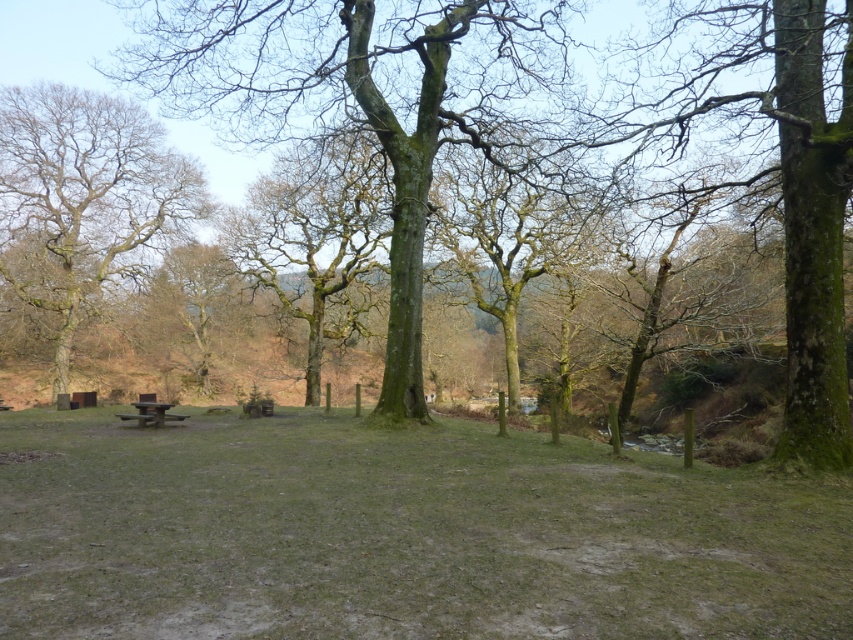
Question: From the image, what is the correct spatial relationship of green grassy field at center in relation to green mossy tree at center?

Choices:
 (A) above
 (B) below

Answer: (B)

Question: Does green grassy field at center have a lesser width compared to wooden park bench at center?

Choices:
 (A) yes
 (B) no

Answer: (B)

Question: Can you confirm if green mossy tree at center is positioned to the left of wooden picnic table at lower left?

Choices:
 (A) yes
 (B) no

Answer: (B)

Question: Considering the real-world distances, which object is closest to the wooden picnic table at lower left?

Choices:
 (A) wooden park bench at center
 (B) green mossy tree at center
 (C) green mossy tree at left
 (D) green grassy field at center

Answer: (A)

Question: Which of the following is the farthest from the observer?

Choices:
 (A) (241, 13)
 (B) (167, 458)

Answer: (A)

Question: Which point is farther from the camera taking this photo?

Choices:
 (A) (503, 141)
 (B) (798, 554)

Answer: (A)